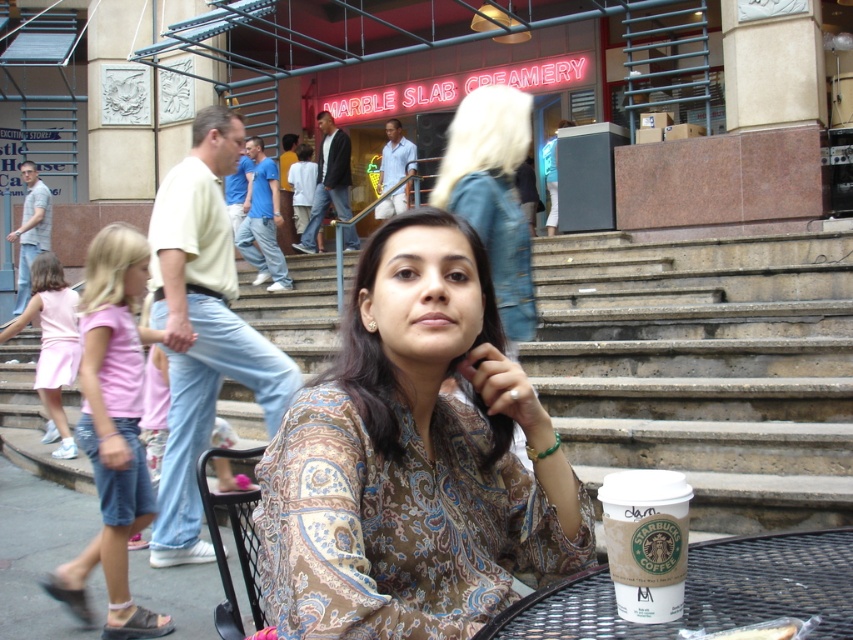
You are a fashion designer observing the scene. You need to decide which garment to recommend for a client who prefers slim fit. Which one between the brown paisley shirt at center and the pink fabric dress at lower left would you suggest?

The brown paisley shirt at center is thinner than the pink fabric dress at lower left, so it would be the better recommendation for a slim fit.

You are a photographer trying to capture the printed silk blouse at center and the white paper cup at lower right in a single frame. Given that your camera has a limited depth of field, which object should you focus on to ensure both are in focus, considering their sizes?

The printed silk blouse at center is larger than the white paper cup at lower right, so focusing on the blouse will help keep both objects in focus due to its larger size occupying more of the frame.

You are a fashion designer analyzing the urban scene. Where is the printed silk blouse at center positioned in terms of coordinates?

The printed silk blouse at center is located at point (x=492, y=195).